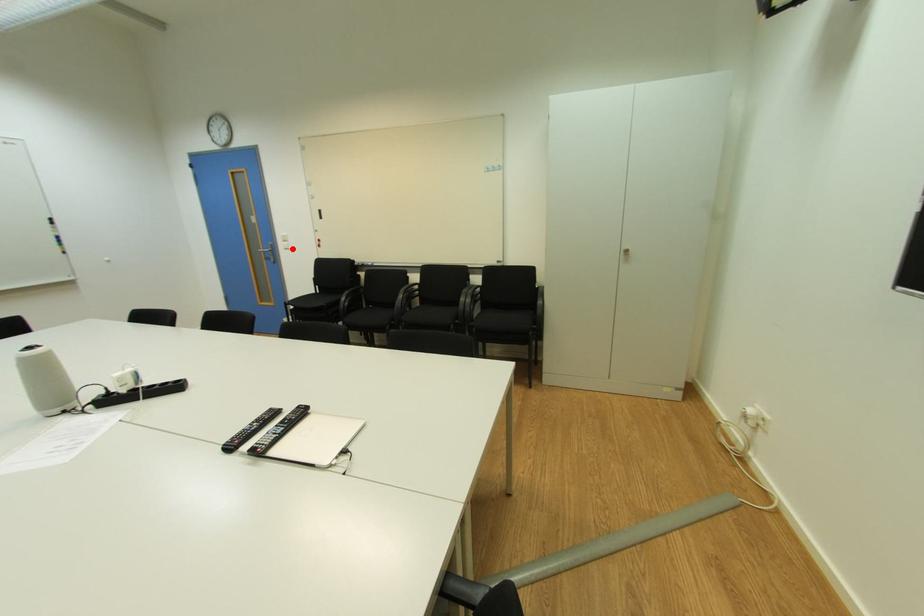
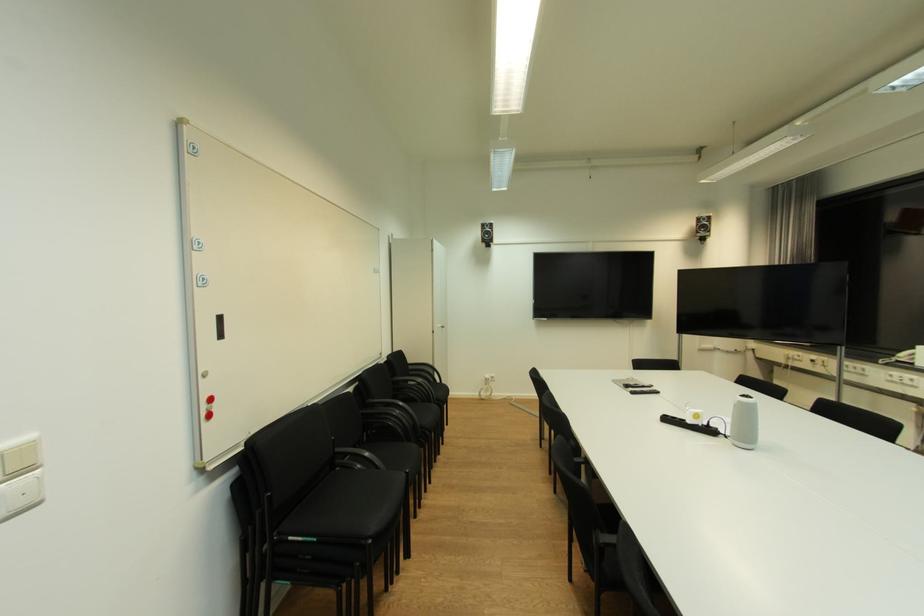
In the second image, find the point that corresponds to the highlighted location in the first image.

(26, 505)